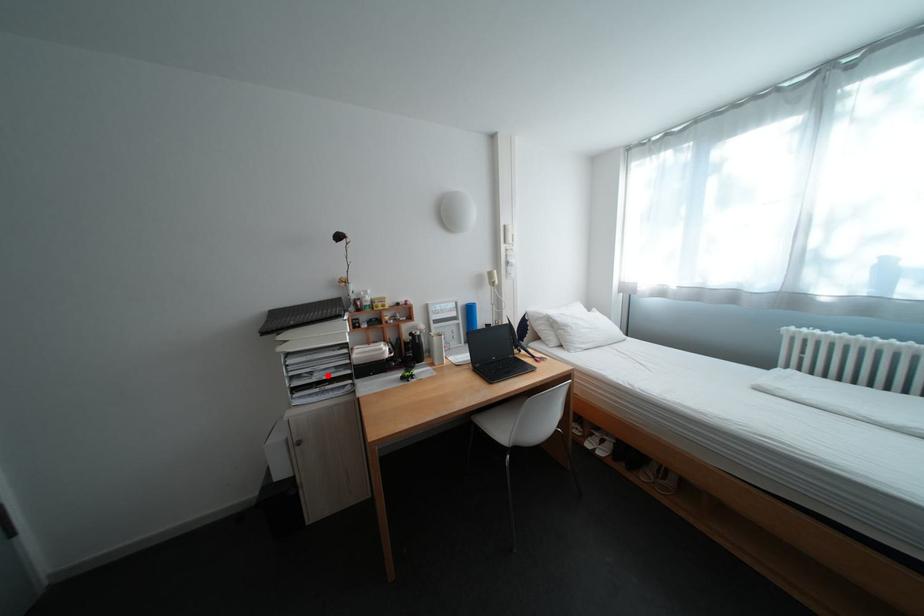
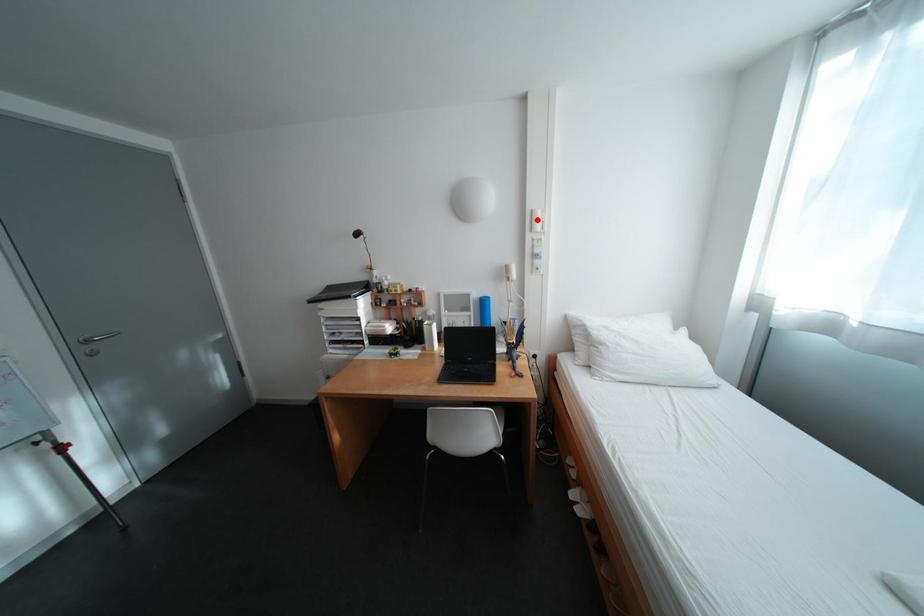
I am providing you with two images of the same scene from different viewpoints. A red point is marked on the first image and another point is marked on the second image. Is the red point in image1 aligned with the point shown in image2?

No